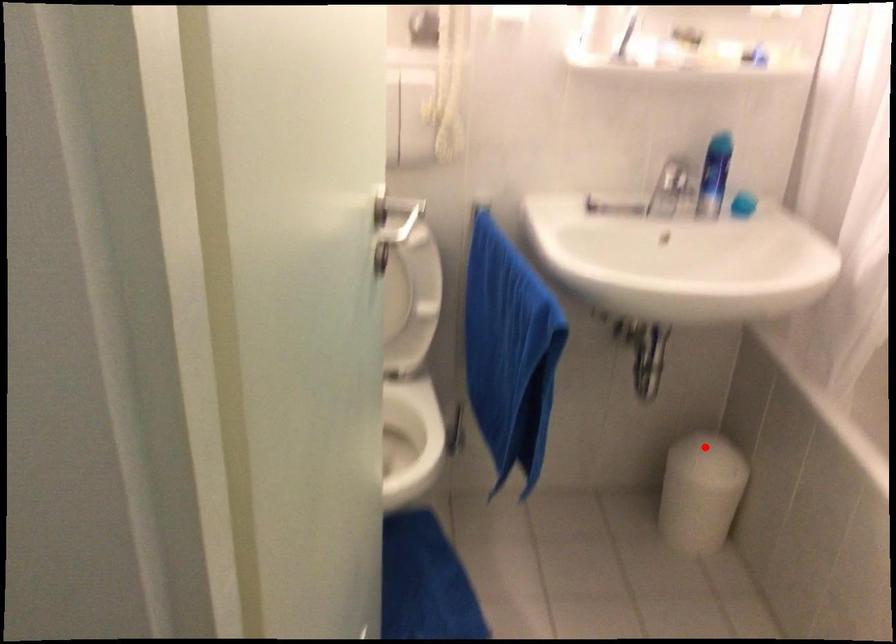
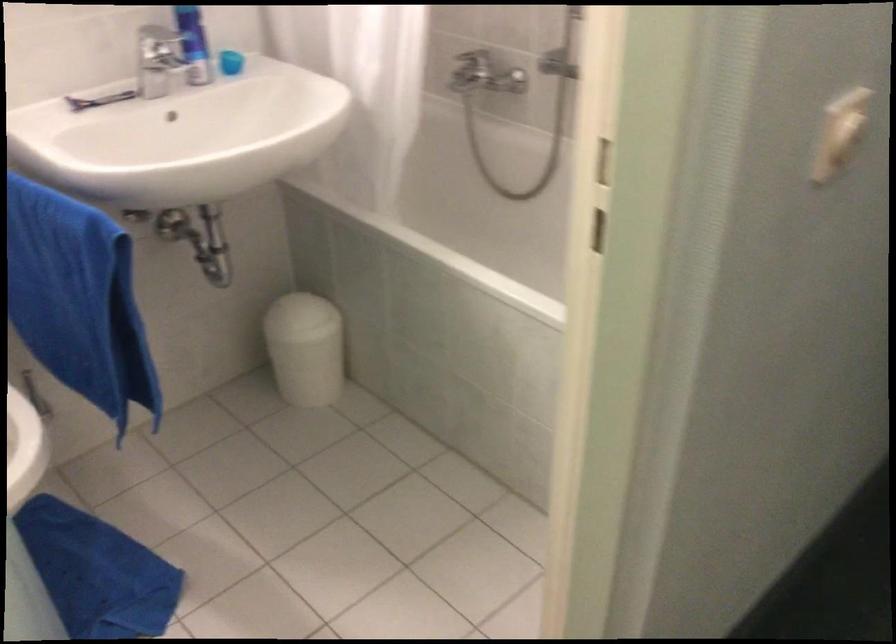
Locate, in the second image, the point that corresponds to the highlighted location in the first image.

(298, 310)